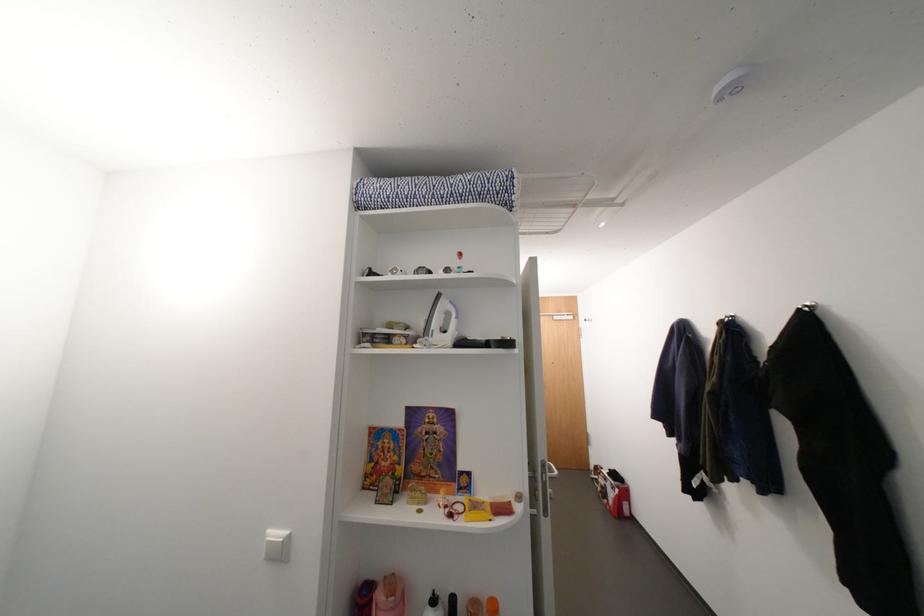
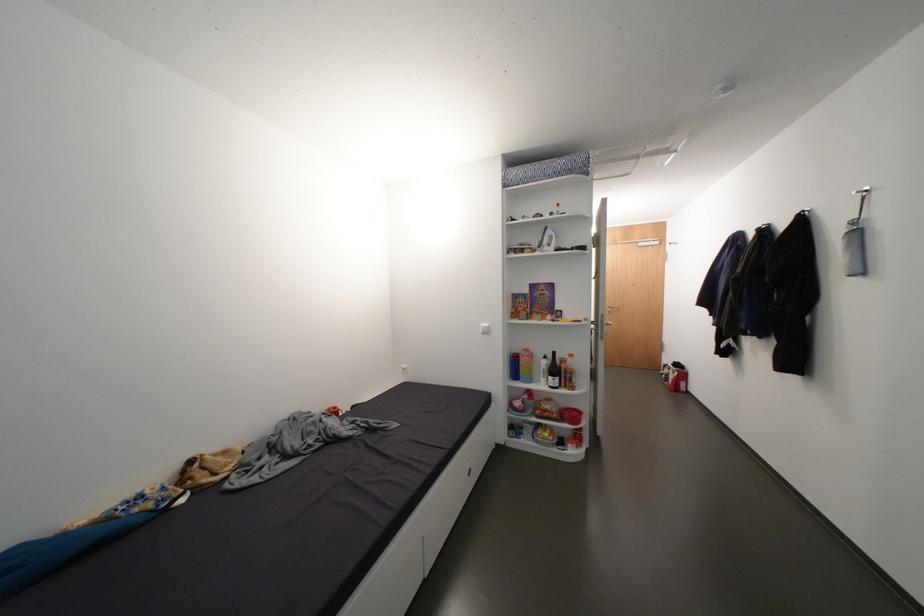
Where in the second image is the point corresponding to (x=625, y=492) from the first image?

(684, 374)